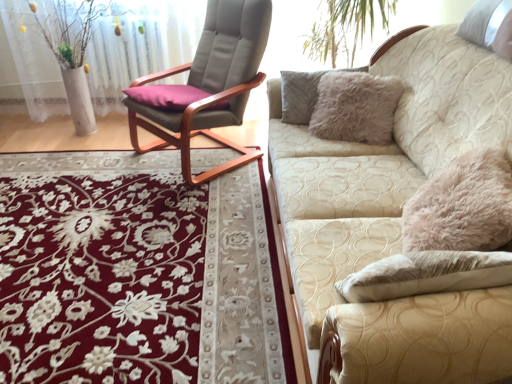
Find the location of a particular element. The width and height of the screenshot is (512, 384). vacant area that is in front of matte gray cushioned chair at center is located at coordinates (181, 211).